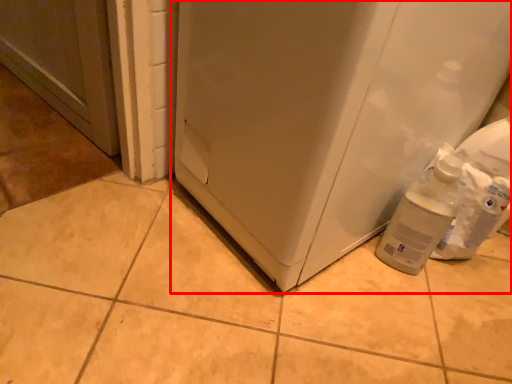
Question: Considering the relative positions of refrigerator (annotated by the red box) and bottle in the image provided, where is refrigerator (annotated by the red box) located with respect to the staircase?

Choices:
 (A) left
 (B) right

Answer: (A)